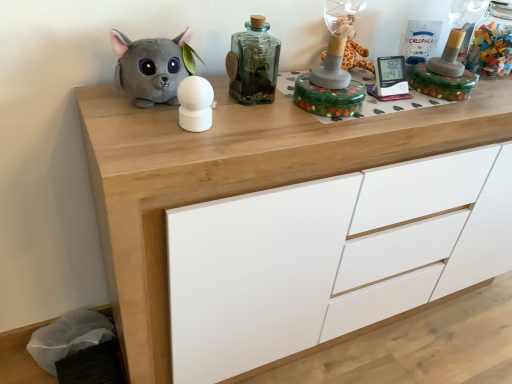
Locate an element on the screen. Image resolution: width=512 pixels, height=384 pixels. vacant area to the right of translucent glass bottle at center, the first bottle when ordered from left to right is located at coordinates (301, 111).